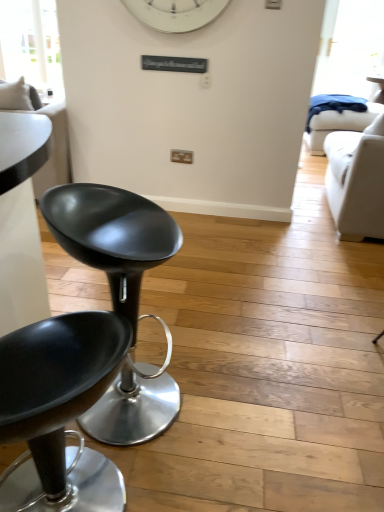
Question: From a real-world perspective, is transparent glass window at upper left above or below matte black stool at left, arranged as the 2th chair when viewed from the front?

Choices:
 (A) above
 (B) below

Answer: (A)

Question: Considering their positions, is transparent glass window at upper left located in front of or behind matte black stool at left, which is the first chair from back to front?

Choices:
 (A) front
 (B) behind

Answer: (B)

Question: Considering the real-world distances, which object is closest to the matte black stool at left, positioned as the first chair in front-to-back order?

Choices:
 (A) white fabric couch at left
 (B) matte black stool at left, which is the first chair from back to front
 (C) white leather couch at right
 (D) transparent glass window at upper left

Answer: (B)

Question: Which of these objects is positioned farthest from the matte black stool at left, acting as the 2th chair starting from the back?

Choices:
 (A) matte black stool at left, which is the first chair from back to front
 (B) white fabric couch at left
 (C) white leather couch at right
 (D) transparent glass window at upper left

Answer: (D)